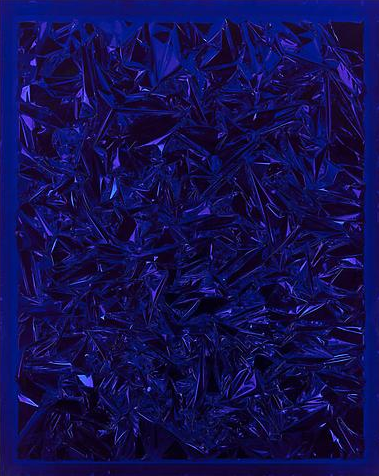
Find the location of a particular element. paitning is located at coordinates (226, 126).